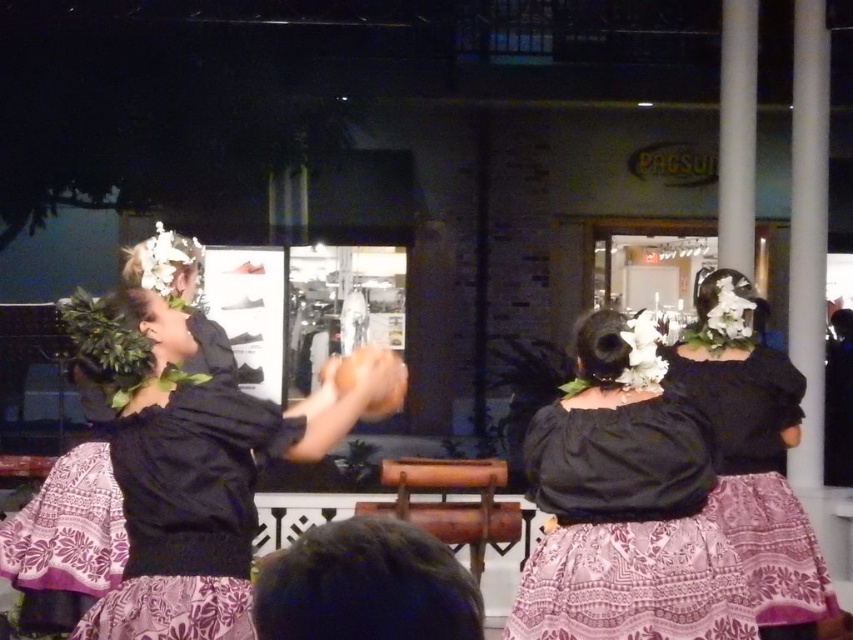
Question: Is matte black blouse at center further to camera compared to black matte dress at upper center?

Choices:
 (A) yes
 (B) no

Answer: (B)

Question: Which object is the farthest from the black matte dress at upper center?

Choices:
 (A) matte black blouse at center
 (B) purple printed dress at center

Answer: (B)

Question: Does matte black blouse at center have a greater width compared to purple printed dress at center?

Choices:
 (A) yes
 (B) no

Answer: (A)

Question: Which object is the farthest from the purple printed dress at center?

Choices:
 (A) black matte dress at upper center
 (B) matte black blouse at center

Answer: (A)

Question: Among these objects, which one is farthest from the camera?

Choices:
 (A) black matte dress at upper center
 (B) matte black blouse at center
 (C) purple printed dress at center

Answer: (A)

Question: Where is matte black blouse at center located in relation to black matte dress at upper center in the image?

Choices:
 (A) above
 (B) below

Answer: (B)